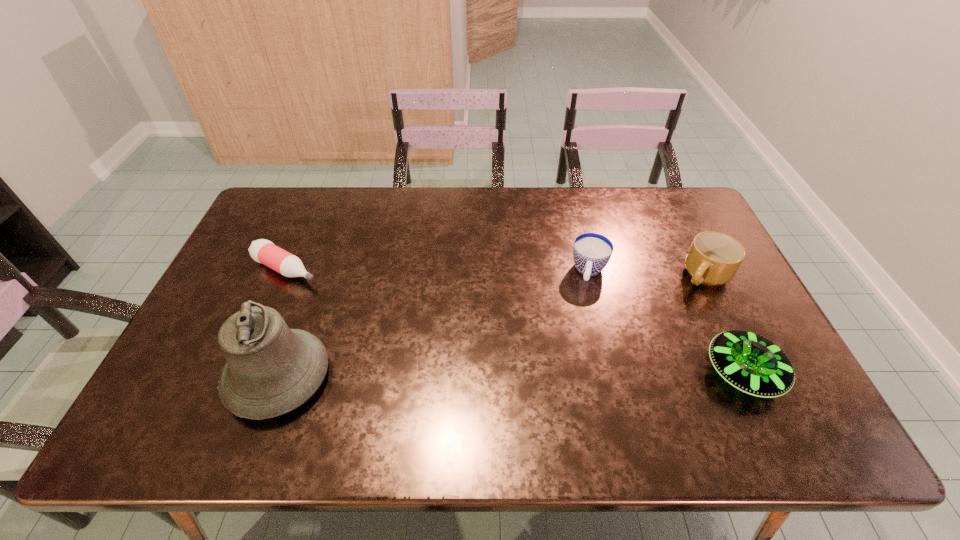
Find the location of a particular element. The width and height of the screenshot is (960, 540). empty space between the bell and the mug is located at coordinates 492,327.

Locate an element on the screen. The height and width of the screenshot is (540, 960). free space between the mug and the saucer is located at coordinates (724, 325).

This screenshot has height=540, width=960. Identify the location of vacant area that lies between the tallest object and the saucer. (511, 375).

Where is `vacant area that lies between the mug and the saucer`? vacant area that lies between the mug and the saucer is located at coordinates (724, 325).

Identify the location of vacant region between the mug and the saucer. (724, 325).

Find the location of `empty space between the tallest object and the saucer`. empty space between the tallest object and the saucer is located at coordinates (511, 375).

The image size is (960, 540). What are the coordinates of `free space between the third object from right to left and the bell` in the screenshot? It's located at [x=434, y=325].

The height and width of the screenshot is (540, 960). What are the coordinates of `vacant space that's between the bell and the third object from right to left` in the screenshot? It's located at (434, 325).

Image resolution: width=960 pixels, height=540 pixels. Find the location of `vacant space that is in between the third object from left to right and the saucer`. vacant space that is in between the third object from left to right and the saucer is located at coordinates (666, 322).

Identify which object is located as the third nearest to the bell. Please provide its 2D coordinates. Your answer should be formatted as a tuple, i.e. [(x, y)], where the tuple contains the x and y coordinates of a point satisfying the conditions above.

[(751, 363)]